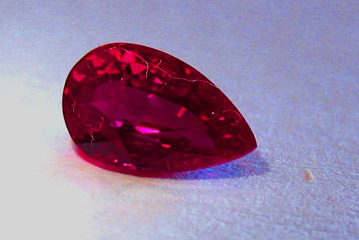
Locate an element on the screen. The width and height of the screenshot is (359, 240). backdrop is located at coordinates (268, 67).